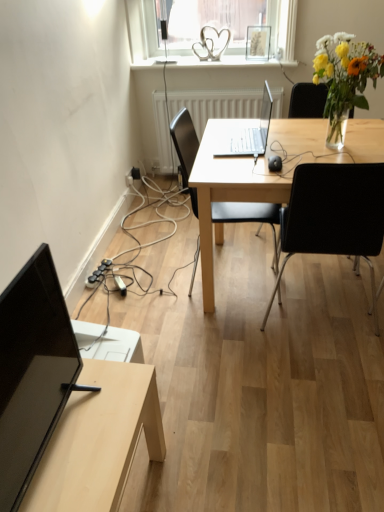
Identify the location of free space in front of silver metallic laptop at center. (253, 166).